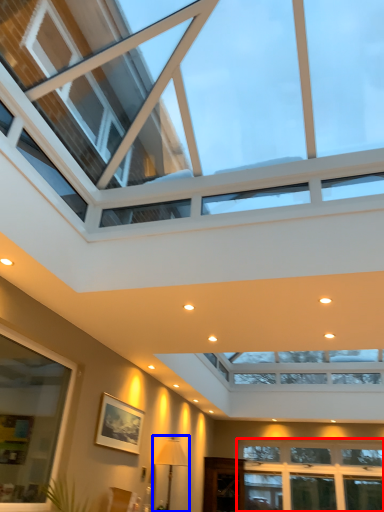
Question: Which point is further to the camera, window (highlighted by a red box) or lamp (highlighted by a blue box)?

Choices:
 (A) window
 (B) lamp

Answer: (A)